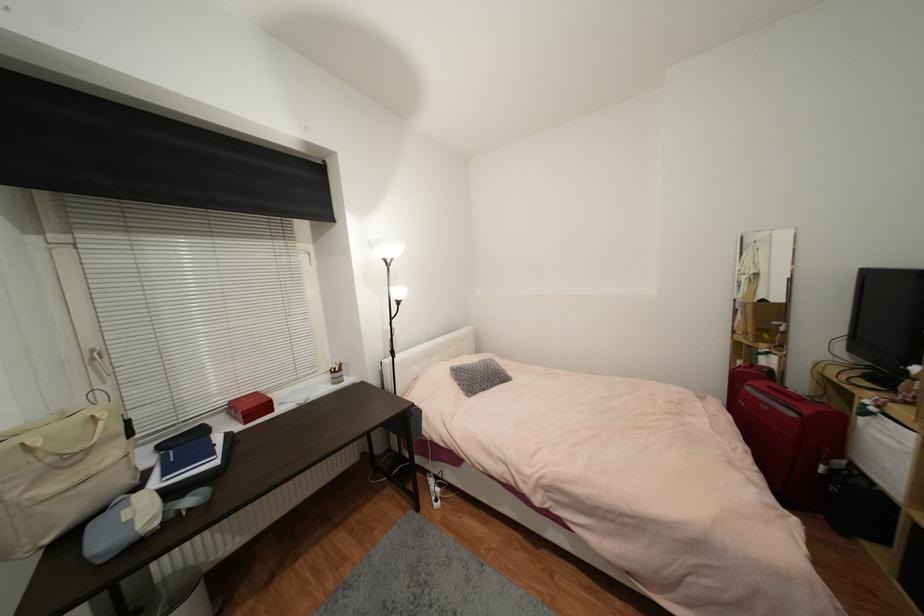
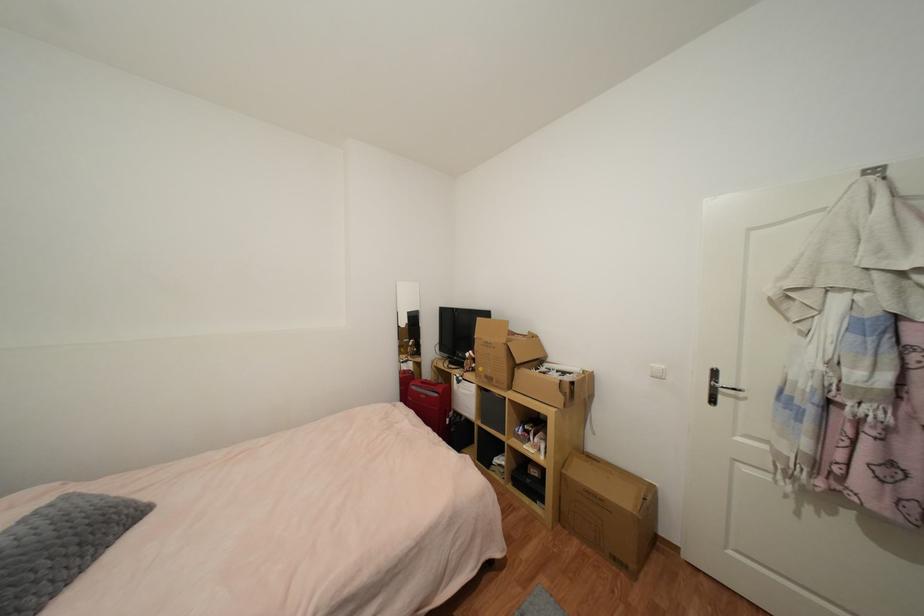
The point at (796, 416) is marked in the first image. Where is the corresponding point in the second image?

(440, 397)